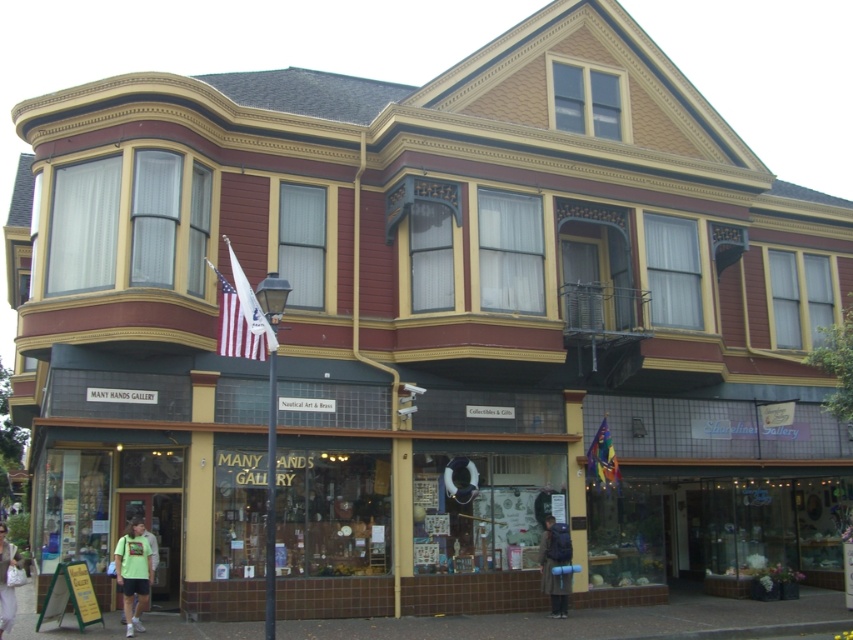
Question: Does dark brown backpack at lower right have a greater width compared to green fabric bag at lower left?

Choices:
 (A) yes
 (B) no

Answer: (B)

Question: Does dark brown backpack at lower right appear over green fabric bag at lower left?

Choices:
 (A) yes
 (B) no

Answer: (A)

Question: Estimate the real-world distances between objects in this image. Which object is closer to the light green t-shirt at lower left?

Choices:
 (A) american flag at center
 (B) rainbow fabric flag at center
 (C) dark brown backpack at lower right

Answer: (A)

Question: Is rainbow fabric flag at center above green fabric bag at lower left?

Choices:
 (A) yes
 (B) no

Answer: (A)

Question: Which point is farther to the camera?

Choices:
 (A) light green t-shirt at lower left
 (B) green fabric bag at lower left
 (C) rainbow fabric flag at center

Answer: (C)

Question: Considering the real-world distances, which object is farthest from the rainbow fabric flag at center?

Choices:
 (A) light green t-shirt at lower left
 (B) green fabric bag at lower left
 (C) dark brown backpack at lower right
 (D) american flag at center

Answer: (B)